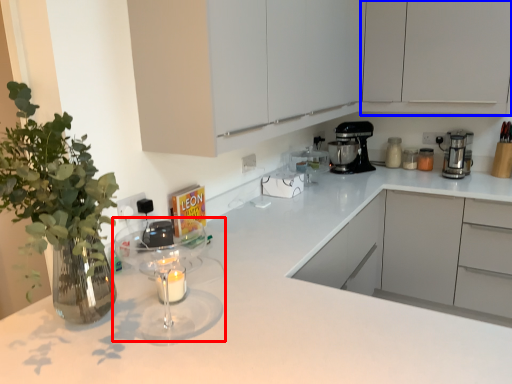
Question: Which of the following is the farthest to the observer, mixer (highlighted by a red box) or cabinetry (highlighted by a blue box)?

Choices:
 (A) mixer
 (B) cabinetry

Answer: (B)